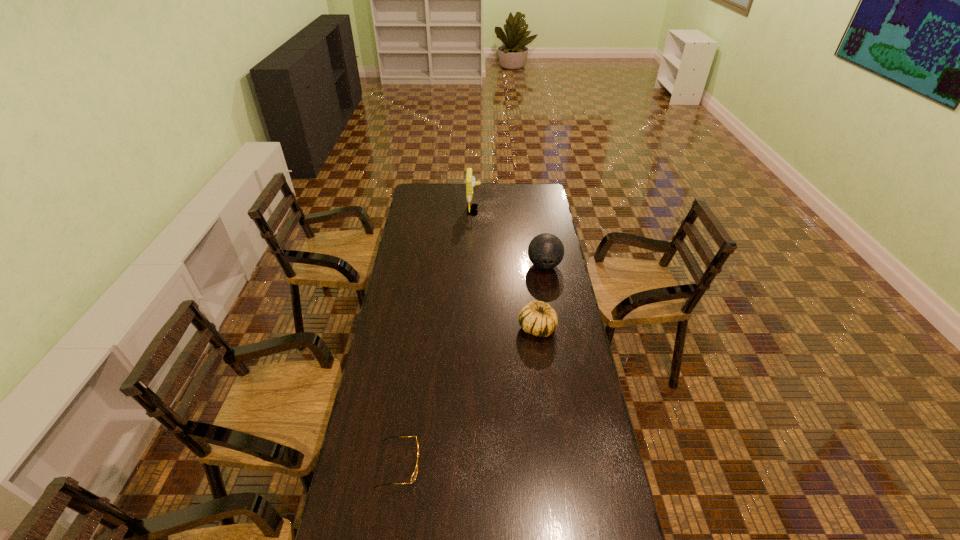
Find the location of a particular element. Image resolution: width=960 pixels, height=540 pixels. object that is the closest to the second tallest object is located at coordinates (537, 318).

Point out which object is positioned as the nearest to the nearest object. Please provide its 2D coordinates. Your answer should be formatted as a tuple, i.e. [(x, y)], where the tuple contains the x and y coordinates of a point satisfying the conditions above.

[(537, 318)]

Where is `blank area in the image that satisfies the following two spatial constraints: 1. on the grip area of the third shortest object; 2. on the front-facing side of the spectacles`? This screenshot has height=540, width=960. blank area in the image that satisfies the following two spatial constraints: 1. on the grip area of the third shortest object; 2. on the front-facing side of the spectacles is located at coordinates (579, 464).

Find the location of a particular element. The width and height of the screenshot is (960, 540). vacant area in the image that satisfies the following two spatial constraints: 1. on the face of the gourd; 2. on the left side of the sponge is located at coordinates (471, 328).

Where is `vacant space that satisfies the following two spatial constraints: 1. on the back side of the second nearest object; 2. on the face of the sponge`? vacant space that satisfies the following two spatial constraints: 1. on the back side of the second nearest object; 2. on the face of the sponge is located at coordinates (521, 210).

At what (x,y) coordinates should I click in order to perform the action: click on vacant space that satisfies the following two spatial constraints: 1. on the face of the farthest object; 2. on the right side of the second nearest object. Please return your answer as a coordinate pair (x, y). This screenshot has width=960, height=540. Looking at the image, I should click on (471, 328).

Identify the location of vacant space that satisfies the following two spatial constraints: 1. on the grip area of the bowling ball; 2. on the front-facing side of the shortest object. (579, 464).